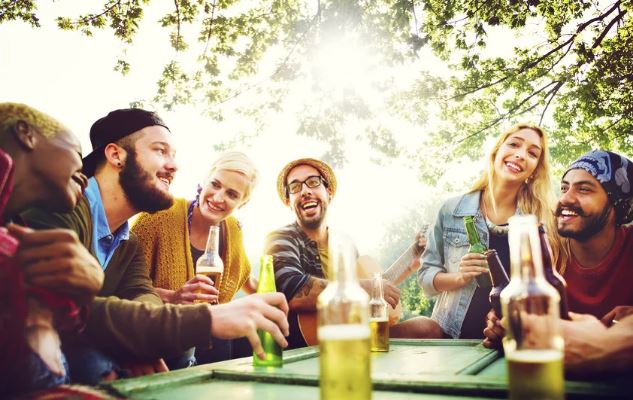
The width and height of the screenshot is (633, 400). What are the coordinates of `beer bottle` in the screenshot? It's located at (266, 275), (211, 262), (342, 315), (379, 310), (473, 238), (492, 268), (517, 302).